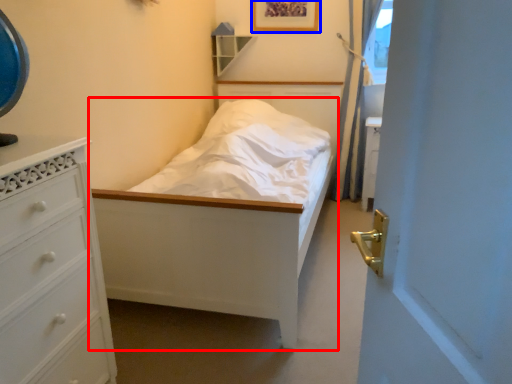
Question: Among these objects, which one is farthest to the camera, bed (highlighted by a red box) or picture frame (highlighted by a blue box)?

Choices:
 (A) bed
 (B) picture frame

Answer: (B)